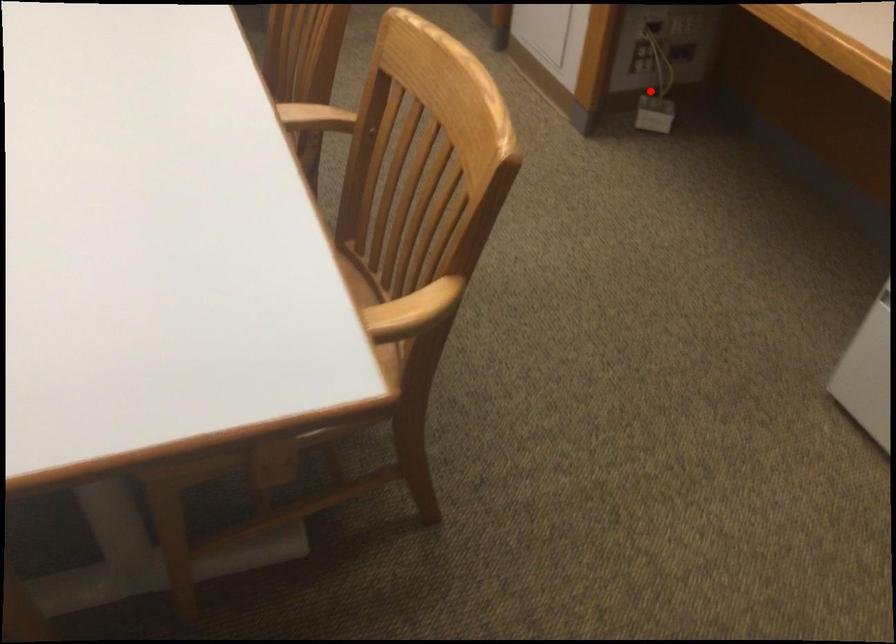
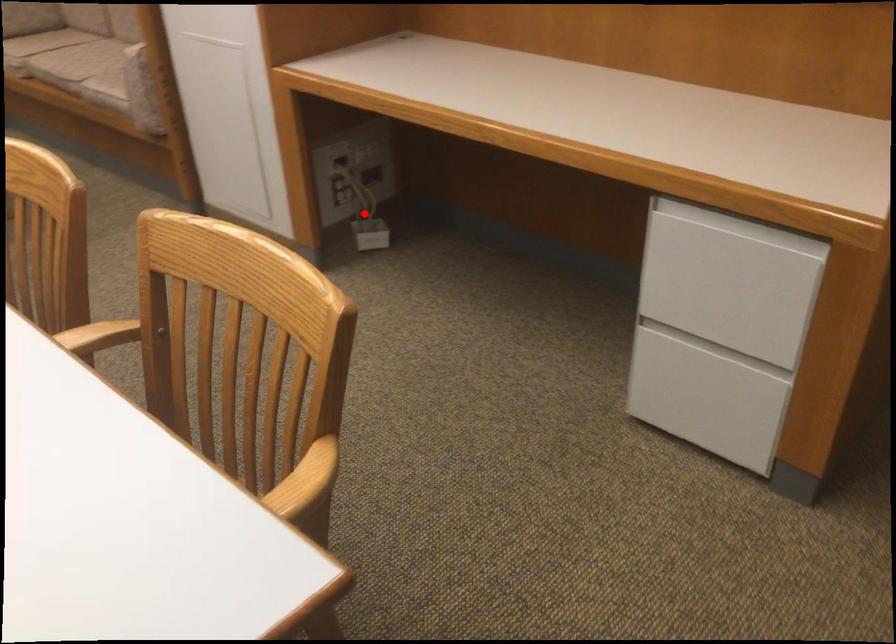
I am providing you with two images of the same scene from different viewpoints. A red point is marked on the first image and another point is marked on the second image. Is the red point in image1 aligned with the point shown in image2?

Yes